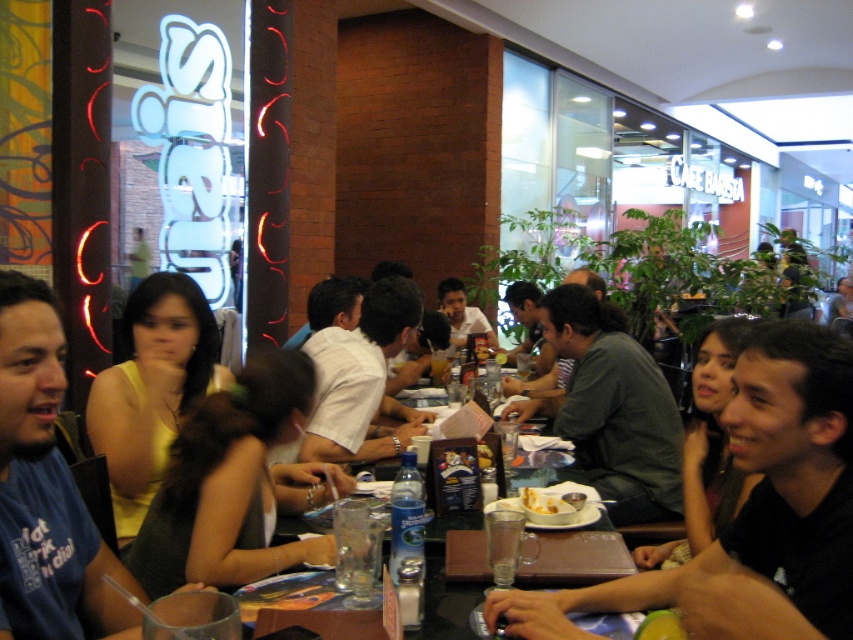
Between dark green fabric dress at center and yellow matte bowl at center, which one appears on the left side from the viewer's perspective?

dark green fabric dress at center

Who is lower down, dark green fabric dress at center or yellow matte bowl at center?

Positioned lower is yellow matte bowl at center.

Where is `dark green fabric dress at center`? The height and width of the screenshot is (640, 853). dark green fabric dress at center is located at coordinates (230, 484).

Based on the photo, between black matte shirt at center and dark green shirt at center, which one is positioned higher?

dark green shirt at center is higher up.

Is point (776, 600) positioned behind point (590, 428)?

No, (776, 600) is closer to viewer.

At what (x,y) coordinates should I click in order to perform the action: click on black matte shirt at center. Please return your answer as a coordinate pair (x, y). Looking at the image, I should click on (753, 508).

Is dark green shirt at center smaller than yellow matte bowl at center?

Incorrect, dark green shirt at center is not smaller in size than yellow matte bowl at center.

Does point (573, 353) lie behind point (532, 509)?

Yes, point (573, 353) is behind point (532, 509).

In order to click on dark green shirt at center in this screenshot , I will do `click(610, 408)`.